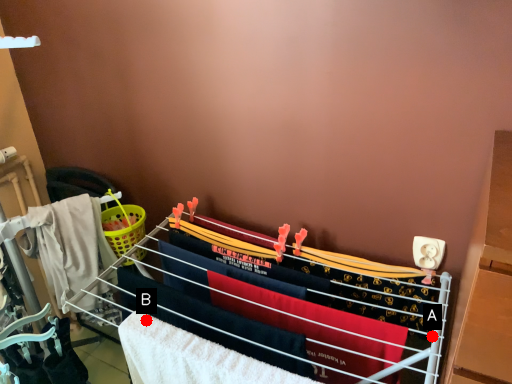
Question: Two points are circled on the image, labeled by A and B beside each circle. Which point appears closest to the camera in this image?

Choices:
 (A) A is closer
 (B) B is closer

Answer: (A)